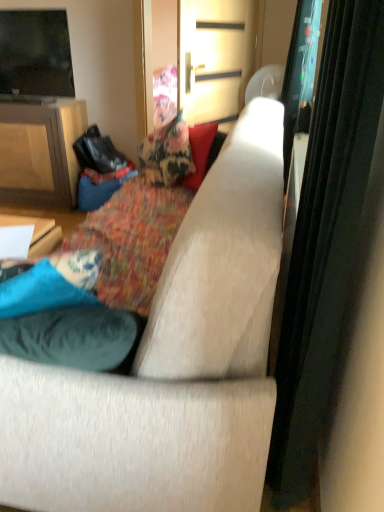
Question: Does flat screen tv at upper left have a smaller size compared to suede-like beige couch at center?

Choices:
 (A) no
 (B) yes

Answer: (B)

Question: Is flat screen tv at upper left thinner than suede-like beige couch at center?

Choices:
 (A) yes
 (B) no

Answer: (A)

Question: Does flat screen tv at upper left come behind suede-like beige couch at center?

Choices:
 (A) yes
 (B) no

Answer: (A)

Question: Could you tell me if flat screen tv at upper left is turned towards suede-like beige couch at center?

Choices:
 (A) no
 (B) yes

Answer: (A)

Question: Does flat screen tv at upper left have a greater height compared to suede-like beige couch at center?

Choices:
 (A) no
 (B) yes

Answer: (A)

Question: From the image's perspective, is flat screen tv at upper left located above suede-like beige couch at center?

Choices:
 (A) no
 (B) yes

Answer: (B)

Question: From a real-world perspective, is metallic gold door at upper center, arranged as the second screen door when viewed from the right, physically above suede-like beige couch at center?

Choices:
 (A) no
 (B) yes

Answer: (B)

Question: From the image's perspective, is metallic gold door at upper center, arranged as the second screen door when viewed from the right, located beneath suede-like beige couch at center?

Choices:
 (A) yes
 (B) no

Answer: (B)

Question: From a real-world perspective, is metallic gold door at upper center, the first screen door when ordered from left to right, positioned under suede-like beige couch at center based on gravity?

Choices:
 (A) yes
 (B) no

Answer: (B)

Question: Does metallic gold door at upper center, the first screen door when ordered from left to right, turn towards suede-like beige couch at center?

Choices:
 (A) no
 (B) yes

Answer: (A)

Question: Is metallic gold door at upper center, arranged as the second screen door when viewed from the right, not close to suede-like beige couch at center?

Choices:
 (A) no
 (B) yes

Answer: (B)

Question: Is metallic gold door at upper center, the first screen door when ordered from left to right, taller than suede-like beige couch at center?

Choices:
 (A) yes
 (B) no

Answer: (B)

Question: Can you see matte wood cabinet at left touching suede-like beige couch at center?

Choices:
 (A) yes
 (B) no

Answer: (B)